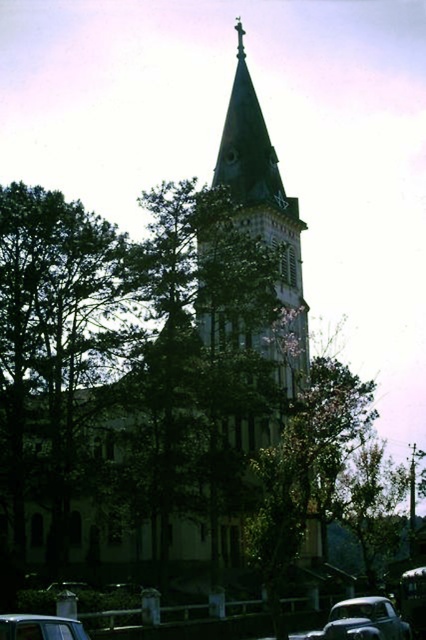
Is green leafy tree at center positioned behind shiny silver car at lower center?

No, it is not.

Who is more distant from viewer, (293, 356) or (367, 616)?

Positioned behind is point (293, 356).

Where is `green leafy tree at center`? The width and height of the screenshot is (426, 640). green leafy tree at center is located at coordinates (134, 371).

Who is higher up, shiny silver car at lower center or metallic silver car at lower left?

metallic silver car at lower left is higher up.

Is point (400, 636) closer to camera compared to point (46, 627)?

That is False.

Who is more forward, (357, 632) or (14, 628)?

Point (14, 628) is more forward.

This screenshot has height=640, width=426. I want to click on shiny silver car at lower center, so click(x=362, y=620).

Is green leafy tree at center shorter than metallic silver car at lower left?

Incorrect, green leafy tree at center's height does not fall short of metallic silver car at lower left's.

Is green leafy tree at center wider than metallic silver car at lower left?

Correct, the width of green leafy tree at center exceeds that of metallic silver car at lower left.

Which is in front, point (46, 358) or point (25, 627)?

Positioned in front is point (25, 627).

The height and width of the screenshot is (640, 426). What are the coordinates of `green leafy tree at center` in the screenshot? It's located at (134, 371).